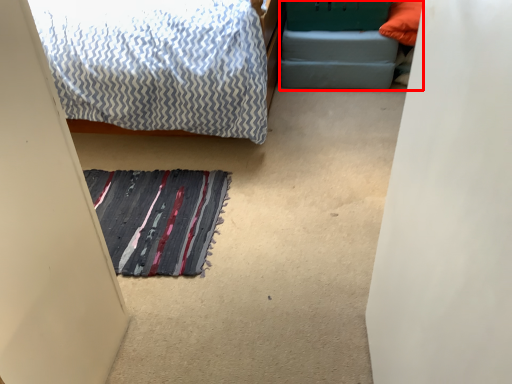
Question: From the image's perspective, where is bed frame (annotated by the red box) located in relation to doormat in the image?

Choices:
 (A) below
 (B) above

Answer: (B)